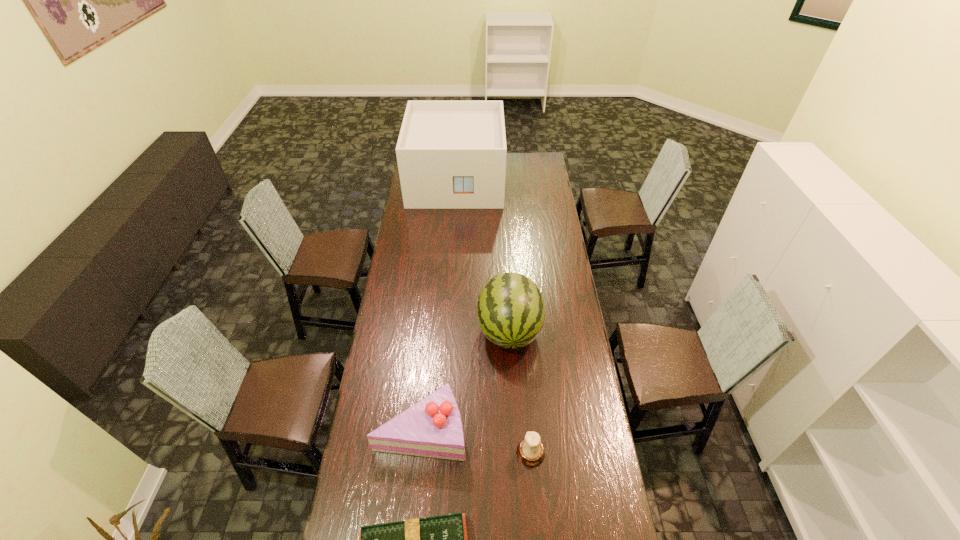
I want to click on box, so click(x=451, y=154).

This screenshot has width=960, height=540. What are the coordinates of `the farthest object` in the screenshot? It's located at click(451, 154).

The height and width of the screenshot is (540, 960). Identify the location of the second tallest object. [x=511, y=312].

Find the location of a particular element. the second farthest object is located at coordinates (511, 312).

At what (x,y) coordinates should I click in order to perform the action: click on cake. Please return your answer as a coordinate pair (x, y). Image resolution: width=960 pixels, height=540 pixels. Looking at the image, I should click on (432, 427).

The height and width of the screenshot is (540, 960). In order to click on the fourth tallest object in this screenshot , I will do `click(530, 451)`.

The image size is (960, 540). In order to click on vacant space located 0.210m on the side of the box with the window in this screenshot , I will do 452,233.

Where is `blank space located at the stem end of the fourth shortest object`? This screenshot has height=540, width=960. blank space located at the stem end of the fourth shortest object is located at coordinates (516, 431).

You are a GUI agent. You are given a task and a screenshot of the screen. Output one action in this format:
    pyautogui.click(x=<x>, y=<y>)
    Task: Click on the free spot located on the back of the cake
    
    Given the screenshot: What is the action you would take?
    pyautogui.click(x=426, y=379)

This screenshot has height=540, width=960. Find the location of `free space located 0.160m on the right of the candle holder`. free space located 0.160m on the right of the candle holder is located at coordinates (591, 453).